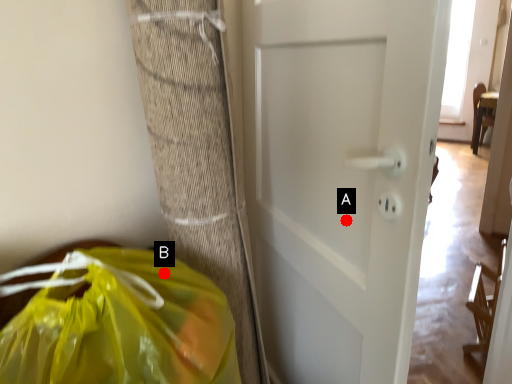
Question: Two points are circled on the image, labeled by A and B beside each circle. Which point is further to the camera?

Choices:
 (A) A is further
 (B) B is further

Answer: (A)